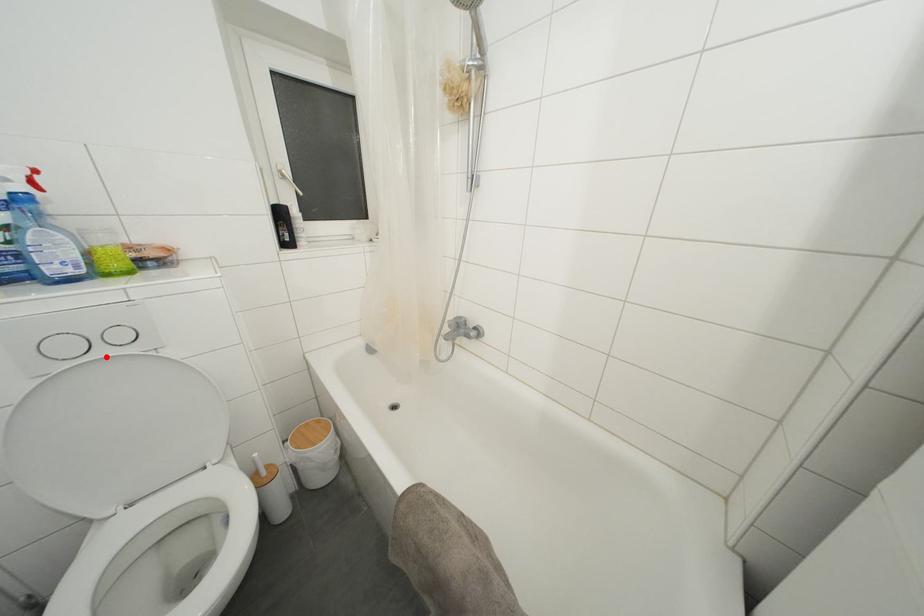
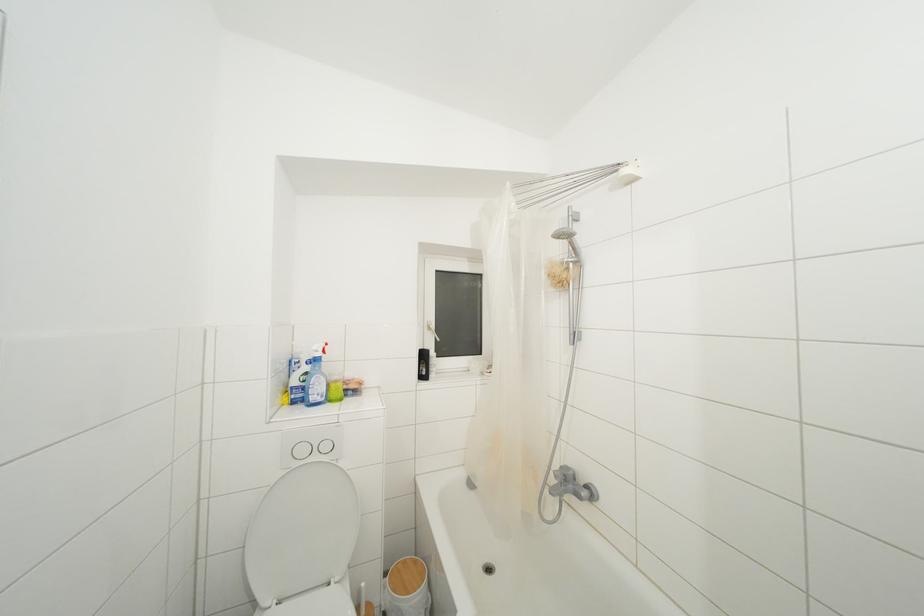
In the second image, find the point that corresponds to the highlighted location in the first image.

(320, 463)